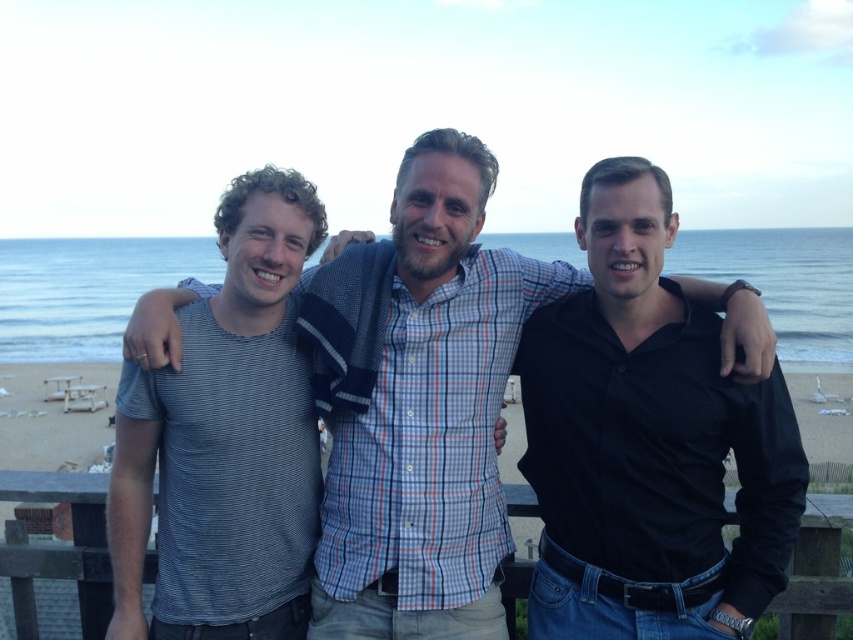
Between striped cotton shirt at center and striped cotton t-shirt at left, which one appears on the left side from the viewer's perspective?

Positioned to the left is striped cotton t-shirt at left.

Can you confirm if striped cotton shirt at center is positioned to the right of striped cotton t-shirt at left?

Yes, striped cotton shirt at center is to the right of striped cotton t-shirt at left.

The height and width of the screenshot is (640, 853). What do you see at coordinates (428, 413) in the screenshot?
I see `striped cotton shirt at center` at bounding box center [428, 413].

You are a GUI agent. You are given a task and a screenshot of the screen. Output one action in this format:
    pyautogui.click(x=<x>, y=<y>)
    Task: Click on the striped cotton shirt at center
    
    Given the screenshot: What is the action you would take?
    pyautogui.click(x=428, y=413)

Does black smooth shirt at right have a greater height compared to striped cotton t-shirt at left?

Incorrect, black smooth shirt at right's height is not larger of striped cotton t-shirt at left's.

Between point (579, 316) and point (144, 465), which one is positioned in front?

Point (144, 465)

The height and width of the screenshot is (640, 853). Describe the element at coordinates (648, 442) in the screenshot. I see `black smooth shirt at right` at that location.

Locate an element on the screen. The height and width of the screenshot is (640, 853). black smooth shirt at right is located at coordinates (648, 442).

Is striped cotton shirt at center taller than beige sand at lower center?

In fact, striped cotton shirt at center may be shorter than beige sand at lower center.

Where is `striped cotton shirt at center`? The image size is (853, 640). striped cotton shirt at center is located at coordinates coord(428,413).